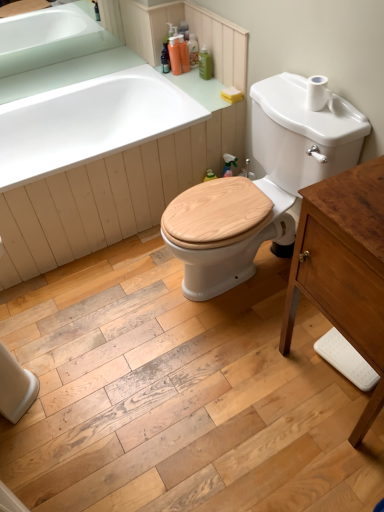
Question: Is white matte toilet paper at upper right outside wooden at center?

Choices:
 (A) yes
 (B) no

Answer: (A)

Question: Does white matte toilet paper at upper right have a smaller size compared to wooden at center?

Choices:
 (A) no
 (B) yes

Answer: (B)

Question: Is white matte toilet paper at upper right bigger than wooden at center?

Choices:
 (A) no
 (B) yes

Answer: (A)

Question: Considering the relative sizes of white matte toilet paper at upper right and wooden at center in the image provided, is white matte toilet paper at upper right wider than wooden at center?

Choices:
 (A) no
 (B) yes

Answer: (A)

Question: From the image's perspective, does white matte toilet paper at upper right appear higher than wooden at center?

Choices:
 (A) no
 (B) yes

Answer: (B)

Question: Can you confirm if white matte toilet paper at upper right is shorter than wooden at center?

Choices:
 (A) no
 (B) yes

Answer: (B)

Question: Is green matte bottle at upper center, the first toiletry in the right-to-left sequence, outside wooden at center?

Choices:
 (A) no
 (B) yes

Answer: (B)

Question: Would you say wooden at center is part of green matte bottle at upper center, the first toiletry in the right-to-left sequence,'s contents?

Choices:
 (A) no
 (B) yes

Answer: (A)

Question: Is green matte bottle at upper center, the 4th toiletry from the left, oriented towards wooden at center?

Choices:
 (A) yes
 (B) no

Answer: (B)

Question: From a real-world perspective, is green matte bottle at upper center, the first toiletry in the right-to-left sequence, located beneath wooden at center?

Choices:
 (A) yes
 (B) no

Answer: (B)

Question: From the image's perspective, is green matte bottle at upper center, the first toiletry in the right-to-left sequence, located above wooden at center?

Choices:
 (A) no
 (B) yes

Answer: (B)

Question: Is green matte bottle at upper center, the 4th toiletry from the left, not close to wooden at center?

Choices:
 (A) no
 (B) yes

Answer: (A)

Question: Is orange plastic bottles at upper center, the fourth toiletry viewed from the right, positioned behind white matte toilet paper at upper right?

Choices:
 (A) no
 (B) yes

Answer: (B)